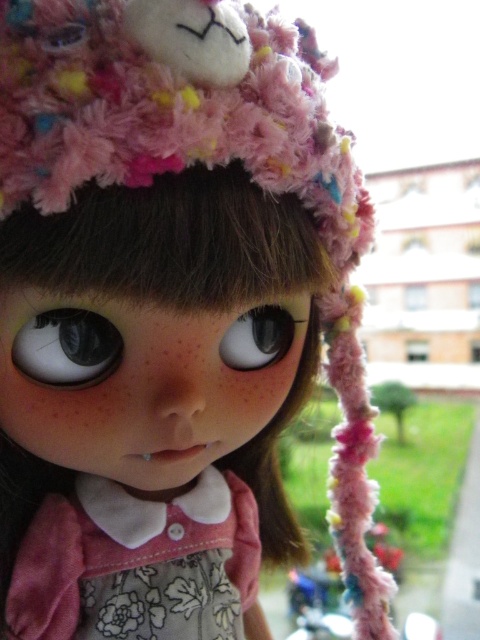
Question: Among these points, which one is farthest from the camera?

Choices:
 (A) (240, 368)
 (B) (67, 547)
 (C) (99, 333)

Answer: (B)

Question: Is matte black eye at center in front of glossy plastic eye at center?

Choices:
 (A) no
 (B) yes

Answer: (B)

Question: Is matte black eye at center bigger than glossy plastic eye at center?

Choices:
 (A) no
 (B) yes

Answer: (A)

Question: Which point is closer to the camera?

Choices:
 (A) floral fabric dress at center
 (B) glossy plastic eye at center
 (C) matte black eye at center

Answer: (C)

Question: Which object is closer to the camera taking this photo?

Choices:
 (A) floral fabric dress at center
 (B) matte black eye at center

Answer: (B)

Question: Considering the relative positions of floral fabric dress at center and matte black eye at center in the image provided, where is floral fabric dress at center located with respect to matte black eye at center?

Choices:
 (A) right
 (B) left

Answer: (A)